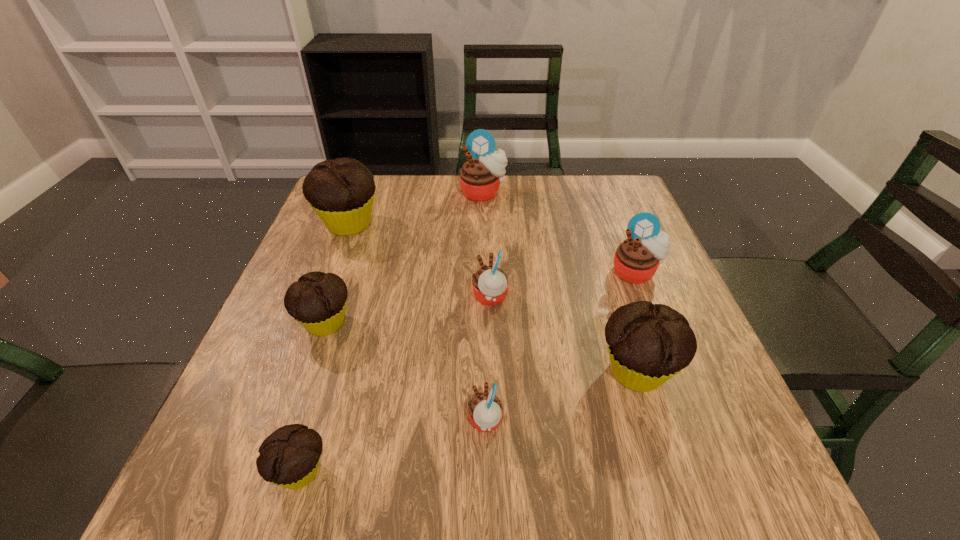
You are a GUI agent. You are given a task and a screenshot of the screen. Output one action in this format:
    pyautogui.click(x=<x>, y=<y>)
    Task: Click on the nearest chocolate muffin
    The height and width of the screenshot is (540, 960).
    Given the screenshot: What is the action you would take?
    pyautogui.click(x=289, y=457)

Where is `vacant space located 0.320m on the front-facing side of the biggest pink muffin`? vacant space located 0.320m on the front-facing side of the biggest pink muffin is located at coordinates (484, 281).

The height and width of the screenshot is (540, 960). I want to click on free space located 0.350m on the front of the seventh nearest muffin, so click(x=298, y=359).

At what (x,y) coordinates should I click in order to perform the action: click on free space located on the front-facing side of the rightmost pink muffin. Please return your answer as a coordinate pair (x, y). The width and height of the screenshot is (960, 540). Looking at the image, I should click on (700, 433).

In order to click on free spot located 0.070m on the front of the third smallest chocolate muffin in this screenshot , I will do `click(660, 444)`.

In order to click on free location located on the front-facing side of the third biggest pink muffin in this screenshot , I will do `click(449, 297)`.

Locate an element on the screen. The image size is (960, 540). vacant region located 0.400m on the front-facing side of the third biggest pink muffin is located at coordinates (288, 297).

At what (x,y) coordinates should I click in order to perform the action: click on blank space located 0.390m on the front-facing side of the third biggest pink muffin. Please return your answer as a coordinate pair (x, y). Looking at the image, I should click on (293, 297).

Locate an element on the screen. Image resolution: width=960 pixels, height=540 pixels. free space located on the right of the second smallest chocolate muffin is located at coordinates (422, 323).

Image resolution: width=960 pixels, height=540 pixels. What are the coordinates of `vacant area situated on the front-facing side of the nearest pink muffin` in the screenshot? It's located at (265, 421).